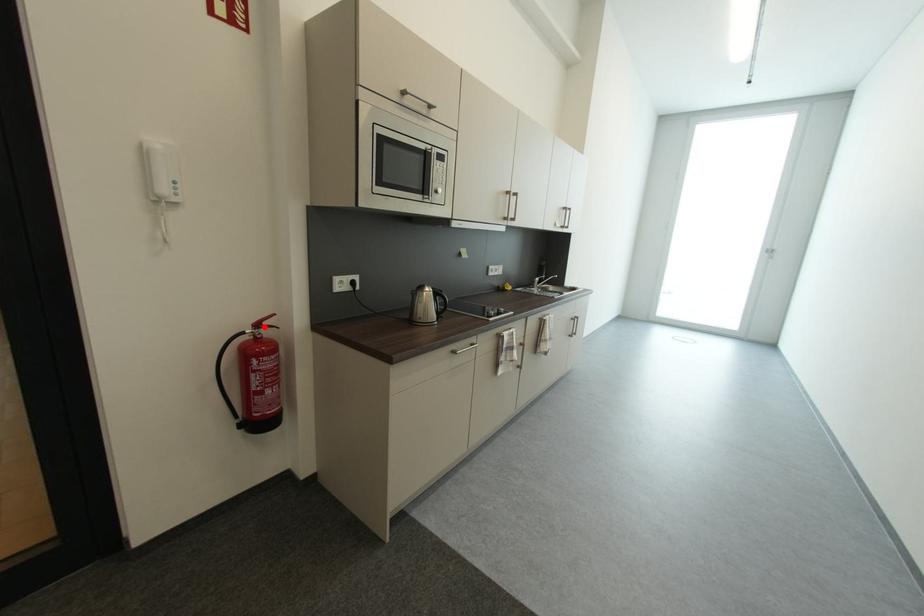
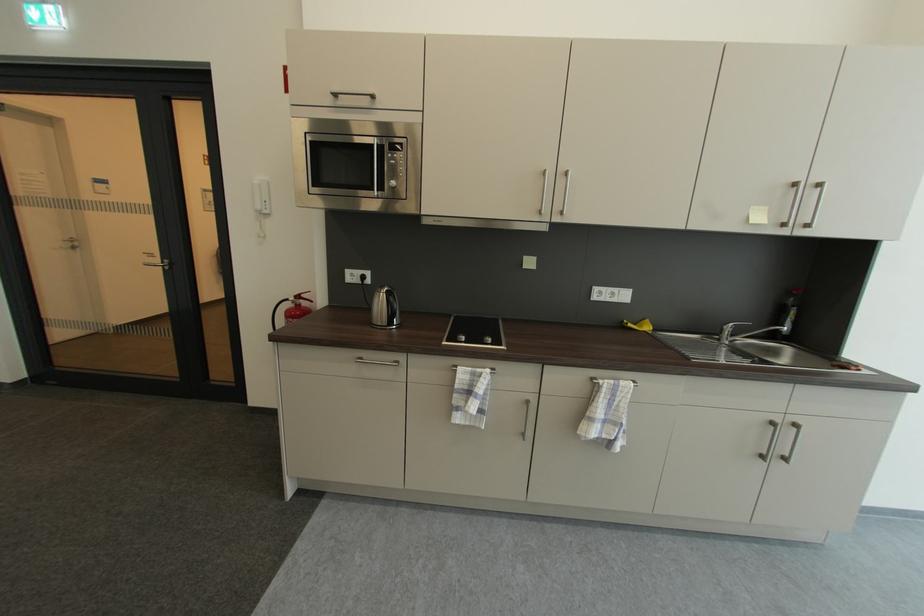
Find the pixel in the second image that matches the highlighted location in the first image.

(305, 299)